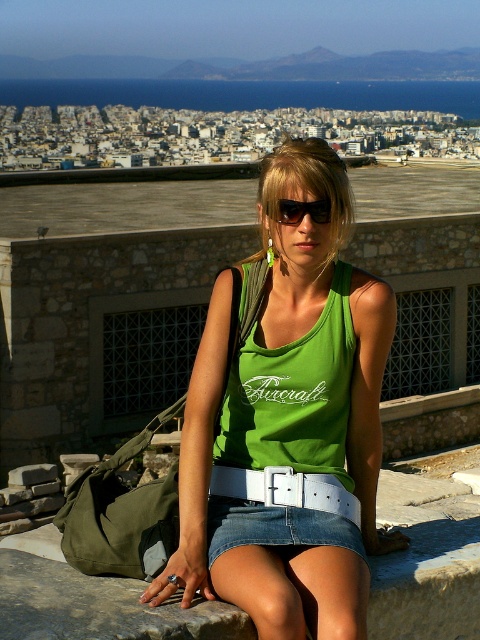
You are a fashion designer observing the person in the scene. You need to measure the distance between the white leather belt at center and the black plastic sunglasses at center for a new clothing line. Can you confirm if the distance is more than 6 meters?

The distance between the white leather belt at center and the black plastic sunglasses at center is 6.89 meters, which is more than 6 meters.